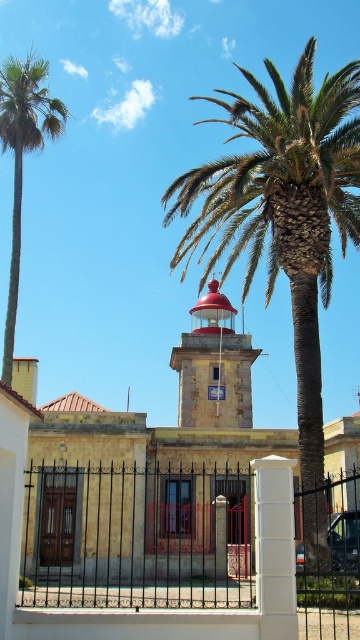
Question: Is iron/golden gate at center positioned at the back of red painted metal bell tower at center?

Choices:
 (A) yes
 (B) no

Answer: (B)

Question: Which object is the farthest from the red painted metal bell tower at center?

Choices:
 (A) green leafy palm at center
 (B) green leafy palm at left
 (C) iron/golden gate at center

Answer: (B)

Question: Can you confirm if red painted metal bell tower at center is smaller than green leafy palm at left?

Choices:
 (A) yes
 (B) no

Answer: (A)

Question: Does iron/golden gate at center have a larger size compared to red painted metal bell tower at center?

Choices:
 (A) yes
 (B) no

Answer: (A)

Question: Which point is farther from the camera taking this photo?

Choices:
 (A) (11, 260)
 (B) (189, 358)

Answer: (B)

Question: Which of the following is the closest to the observer?

Choices:
 (A) 37,118
 (B) 284,579

Answer: (B)